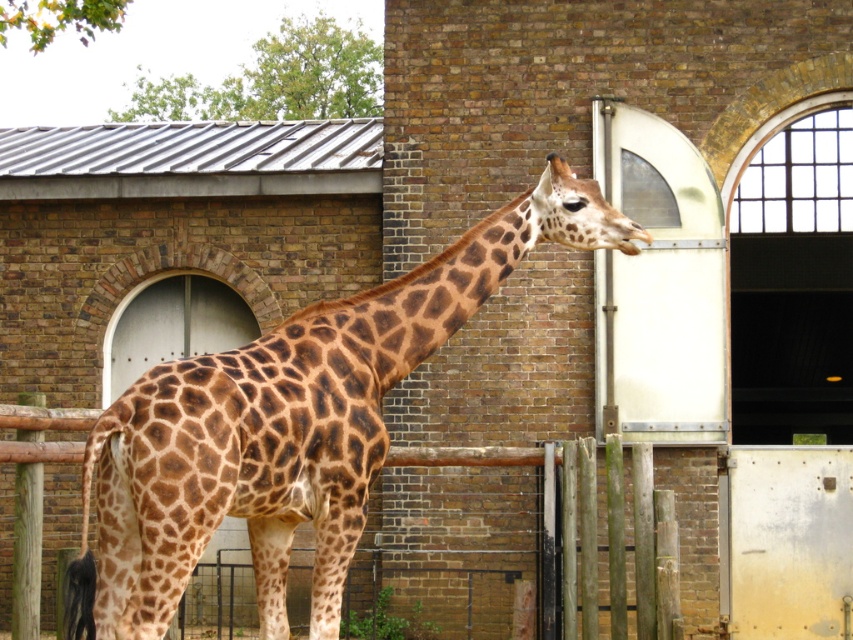
Between point (318, 561) and point (553, 460), which one is positioned behind?

Point (553, 460)

Between point (283, 465) and point (613, 570), which one is positioned in front?

Point (283, 465) is more forward.

Measure the distance between brown spotted giraffe at center and camera.

brown spotted giraffe at center is 30.02 feet from camera.

Locate an element on the screen. This screenshot has height=640, width=853. brown spotted giraffe at center is located at coordinates (289, 426).